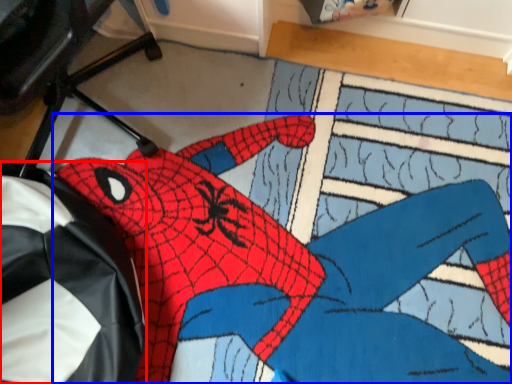
Question: Which object appears closest to the camera in this image, bean bag chair (highlighted by a red box) or person (highlighted by a blue box)?

Choices:
 (A) bean bag chair
 (B) person

Answer: (A)